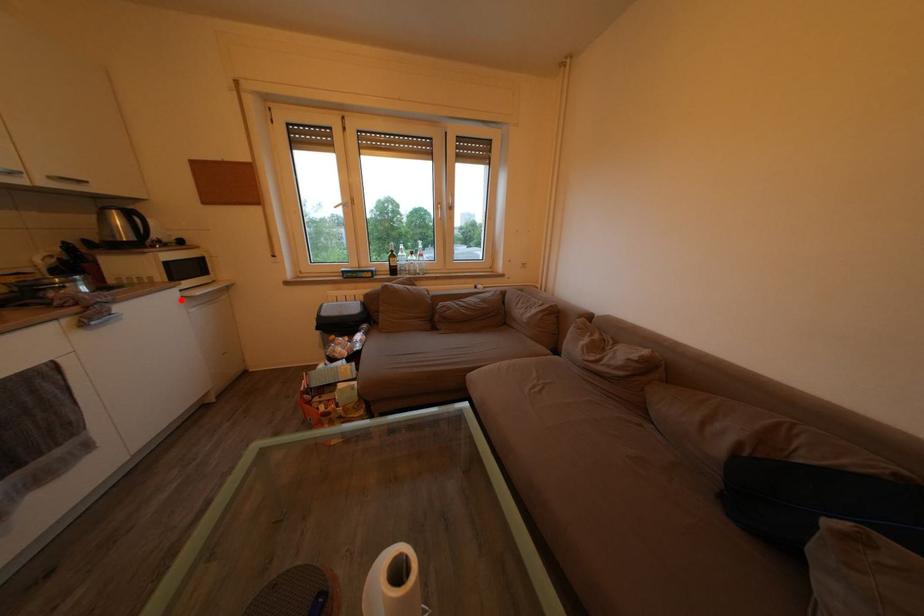
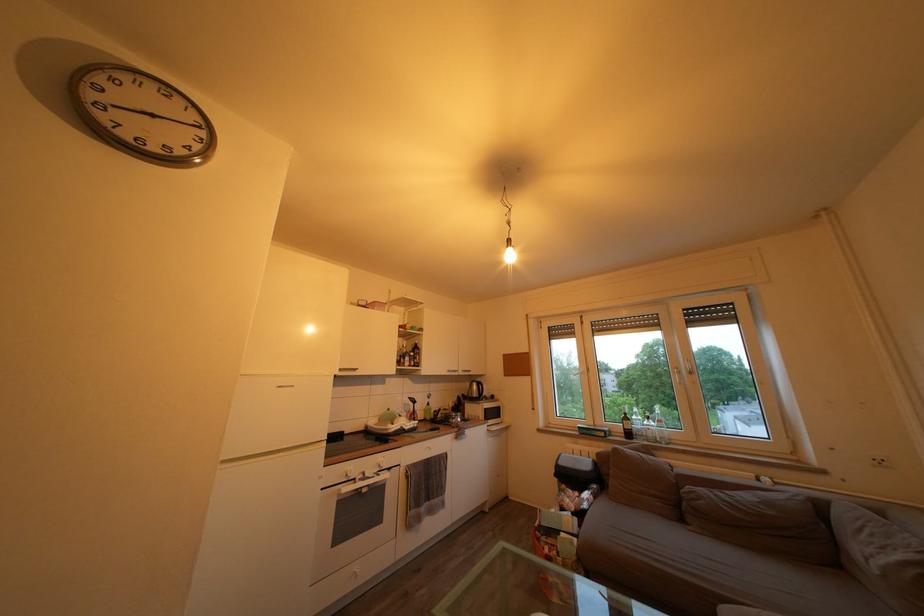
Question: A red point is marked in image1. In image2, is the corresponding 3D point closer to the camera or farther? Reply with the corresponding letter.

Choices:
 (A) The corresponding 3D point is closer.
 (B) The corresponding 3D point is farther.

Answer: (B)